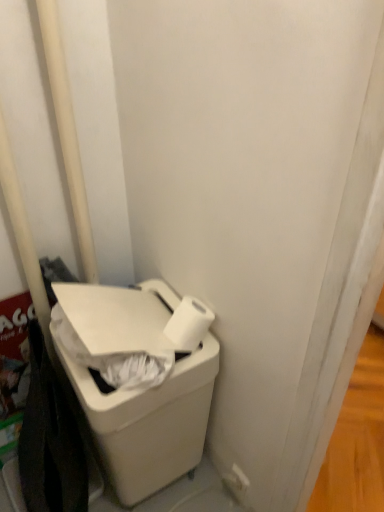
Question: Based on their positions, is white matte toilet paper at lower right located to the left or right of white plastic pole at left?

Choices:
 (A) left
 (B) right

Answer: (B)

Question: In terms of height, does white matte toilet paper at lower right look taller or shorter compared to white plastic pole at left?

Choices:
 (A) short
 (B) tall

Answer: (A)

Question: Which object is positioned farthest from the white plastic pole at left?

Choices:
 (A) white matte toilet paper at lower right
 (B) white plastic waste container at lower left

Answer: (A)

Question: Which of these objects is positioned farthest from the white matte toilet paper at lower right?

Choices:
 (A) white plastic pole at left
 (B) white plastic waste container at lower left

Answer: (A)